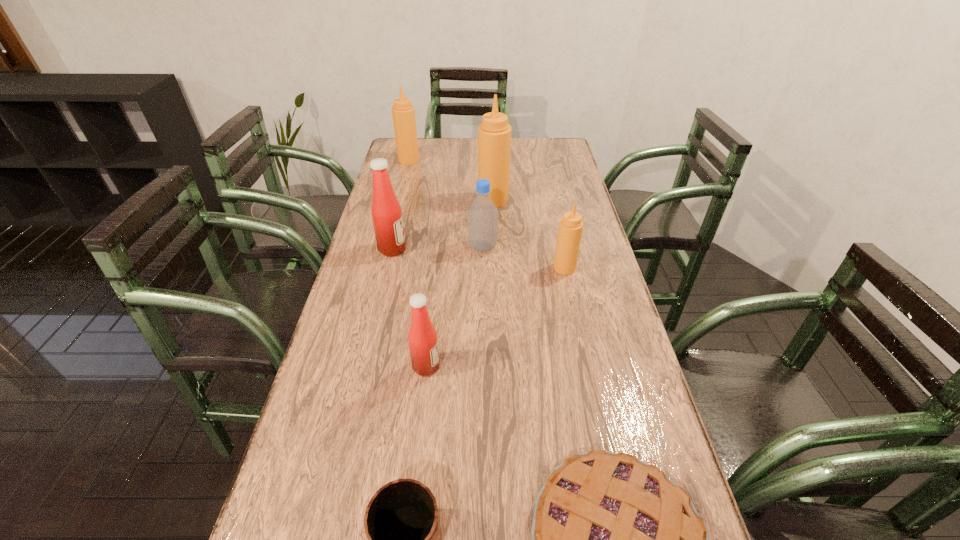
I want to click on the fourth condiment from left to right, so click(494, 133).

Where is `the second farthest condiment`? The height and width of the screenshot is (540, 960). the second farthest condiment is located at coordinates [x=494, y=133].

The image size is (960, 540). Find the location of `the farthest condiment`. the farthest condiment is located at coordinates (403, 112).

The image size is (960, 540). In order to click on the second smallest tan condiment in this screenshot , I will do `click(403, 112)`.

Locate an element on the screen. the farther red condiment is located at coordinates (387, 218).

At what (x,y) coordinates should I click in order to perform the action: click on the third nearest condiment. Please return your answer as a coordinate pair (x, y). The width and height of the screenshot is (960, 540). Looking at the image, I should click on (387, 218).

The height and width of the screenshot is (540, 960). What are the coordinates of `bottle` in the screenshot? It's located at (482, 217).

You are a GUI agent. You are given a task and a screenshot of the screen. Output one action in this format:
    pyautogui.click(x=<x>, y=<y>)
    Task: Click on the fourth farthest condiment
    This screenshot has width=960, height=540.
    Given the screenshot: What is the action you would take?
    pyautogui.click(x=570, y=230)

I want to click on the smallest tan condiment, so click(570, 230).

This screenshot has height=540, width=960. In order to click on the nearer red condiment in this screenshot , I will do `click(423, 343)`.